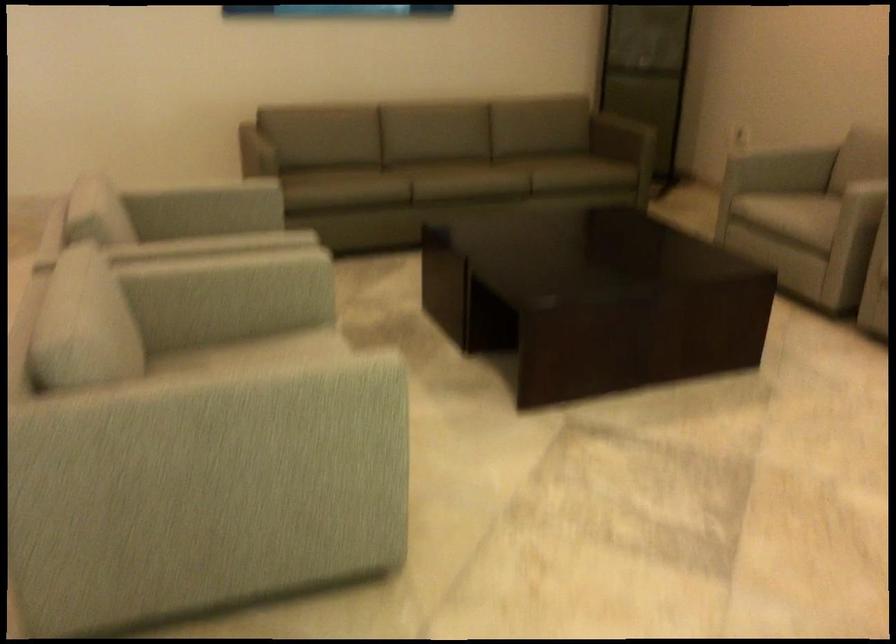
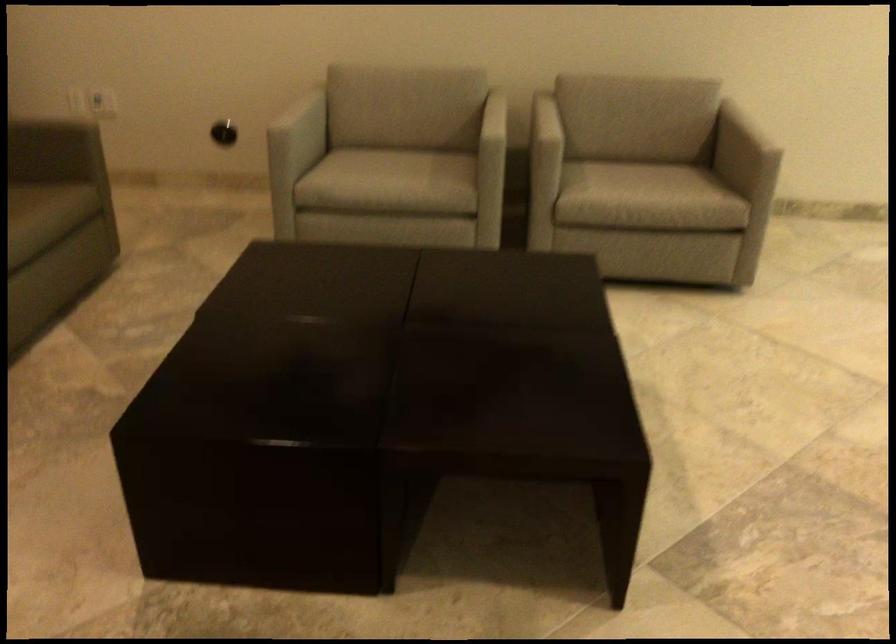
Find the pixel in the second image that matches (572,176) in the first image.

(36, 219)